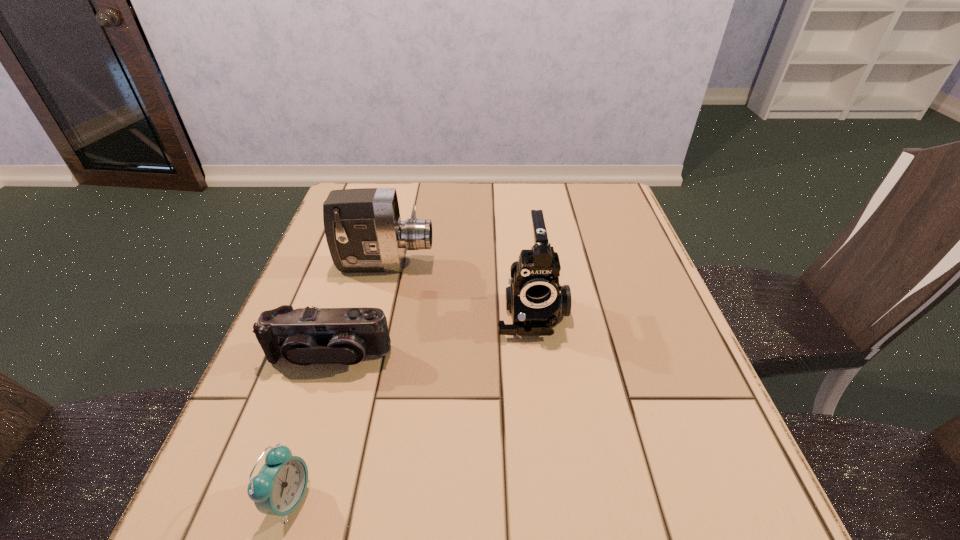
I want to click on the rightmost camcorder, so click(535, 298).

You are a GUI agent. You are given a task and a screenshot of the screen. Output one action in this format:
    pyautogui.click(x=<x>, y=<y>)
    Task: Click on the farthest object
    
    Given the screenshot: What is the action you would take?
    pyautogui.click(x=364, y=232)

The image size is (960, 540). What are the coordinates of `the shortest camcorder` in the screenshot? It's located at (303, 336).

You are a GUI agent. You are given a task and a screenshot of the screen. Output one action in this format:
    pyautogui.click(x=<x>, y=<y>)
    Task: Click on the alarm clock
    The width and height of the screenshot is (960, 540).
    Given the screenshot: What is the action you would take?
    pyautogui.click(x=278, y=489)

Identify the location of free space located 0.300m on the lens mount of the rightmost object. The width and height of the screenshot is (960, 540). (553, 492).

Locate an element on the screen. vacant space located 0.330m at the front of the farthest camcorder, highlighting the lens is located at coordinates (567, 264).

The width and height of the screenshot is (960, 540). Identify the location of vacant position located on the front-facing side of the shortest camcorder. tap(308, 421).

This screenshot has height=540, width=960. I want to click on blank space located on the face of the nearest object, so click(x=554, y=498).

The width and height of the screenshot is (960, 540). I want to click on object at the near edge, so click(278, 489).

Image resolution: width=960 pixels, height=540 pixels. I want to click on alarm clock that is at the left edge, so click(278, 489).